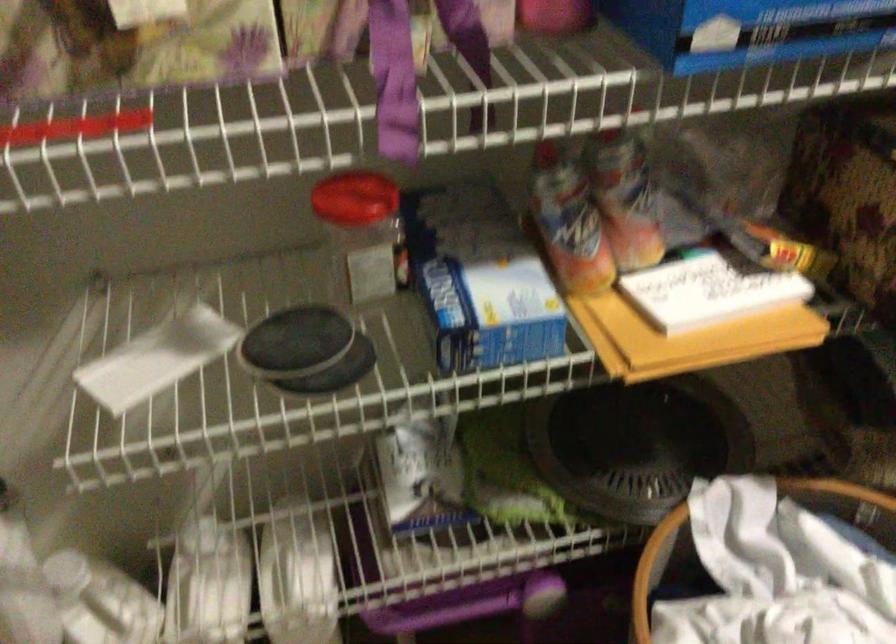
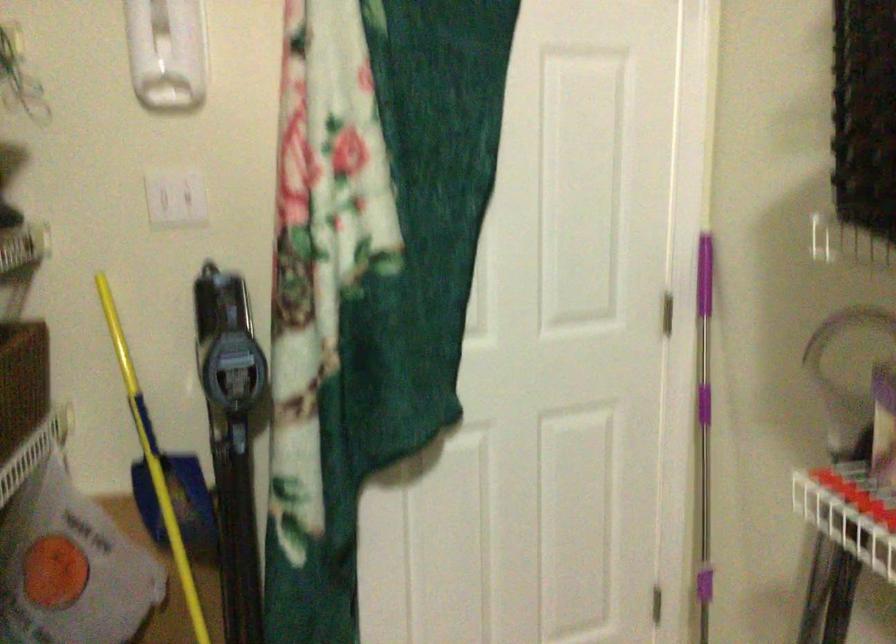
Question: The camera is either moving clockwise (left) or counter-clockwise (right) around the object. The first image is from the beginning of the video and the second image is from the end. Is the camera moving left or right when shooting the video?

Choices:
 (A) Left
 (B) Right

Answer: (B)